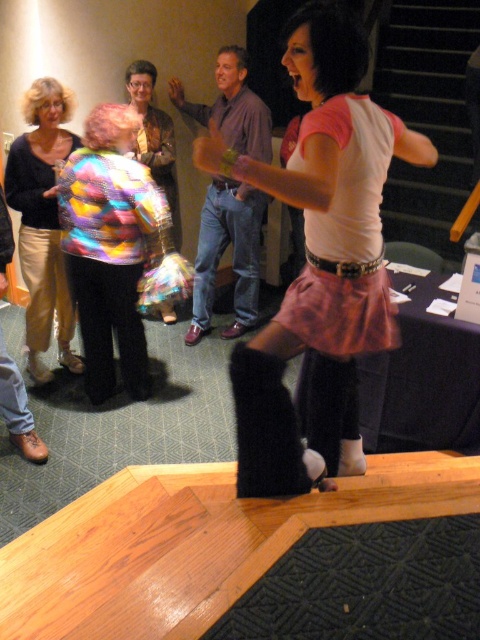
Question: Is multicolored fabric jacket at center to the left of matte black sweater at left from the viewer's perspective?

Choices:
 (A) no
 (B) yes

Answer: (A)

Question: Is multicolored fabric jacket at center above matte black sweater at left?

Choices:
 (A) no
 (B) yes

Answer: (A)

Question: Estimate the real-world distances between objects in this image. Which object is closer to the multicolored fabric jacket at center?

Choices:
 (A) matte black sweater at left
 (B) rainbow sequined jacket at center
 (C) pink fabric skirt at center

Answer: (A)

Question: Where is pink fabric skirt at center located in relation to rainbow sequined jacket at center in the image?

Choices:
 (A) right
 (B) left

Answer: (A)

Question: Which point is farther to the camera?

Choices:
 (A) (90, 152)
 (B) (132, 96)
 (C) (373, 208)

Answer: (B)

Question: Estimate the real-world distances between objects in this image. Which object is closer to the matte black sweater at left?

Choices:
 (A) multicolored fabric jacket at center
 (B) rainbow sequined jacket at center

Answer: (A)